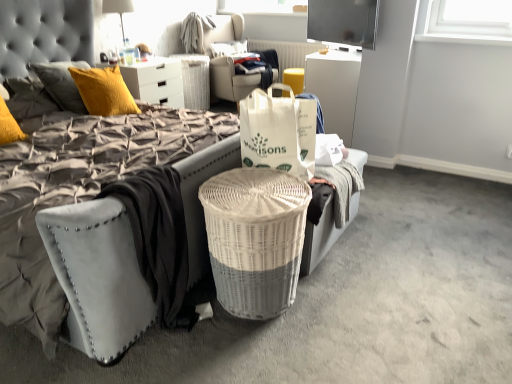
Locate an element on the screen. This screenshot has height=384, width=512. free space in front of white wicker picnic basket at center is located at coordinates (255, 355).